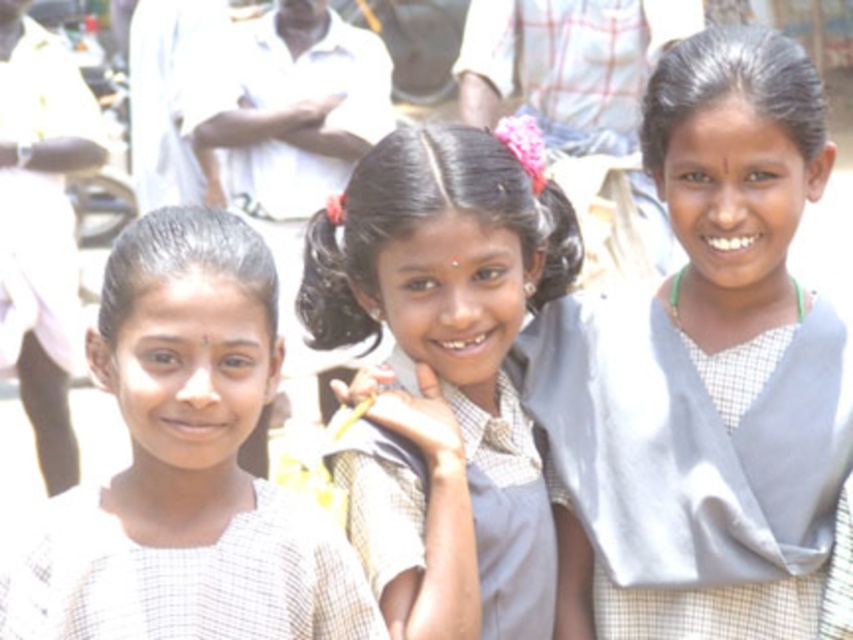
Question: Can you confirm if light gray fabric sari at center is wider than matte gray uniform at center?

Choices:
 (A) yes
 (B) no

Answer: (B)

Question: Which of the following is the closest to the observer?

Choices:
 (A) matte gray uniform at center
 (B) white checkered shirt at left

Answer: (B)

Question: Which point is closer to the camera?

Choices:
 (A) white checkered shirt at left
 (B) light gray fabric sari at center

Answer: (A)

Question: Does light gray fabric sari at center have a larger size compared to white checkered shirt at left?

Choices:
 (A) no
 (B) yes

Answer: (A)

Question: Estimate the real-world distances between objects in this image. Which object is closer to the white checkered shirt at left?

Choices:
 (A) matte gray uniform at center
 (B) light gray fabric sari at center

Answer: (A)

Question: Can you confirm if matte gray uniform at center is bigger than white checkered shirt at left?

Choices:
 (A) no
 (B) yes

Answer: (A)